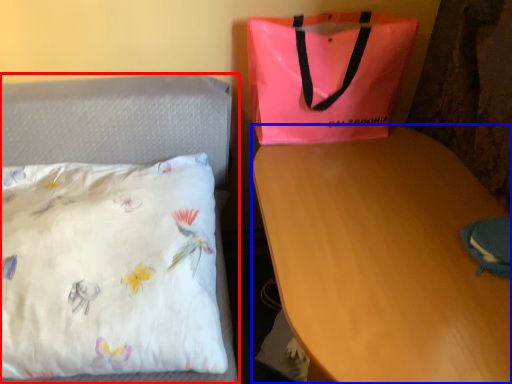
Question: Which point is closer to the camera, bed (highlighted by a red box) or desk (highlighted by a blue box)?

Choices:
 (A) bed
 (B) desk

Answer: (A)